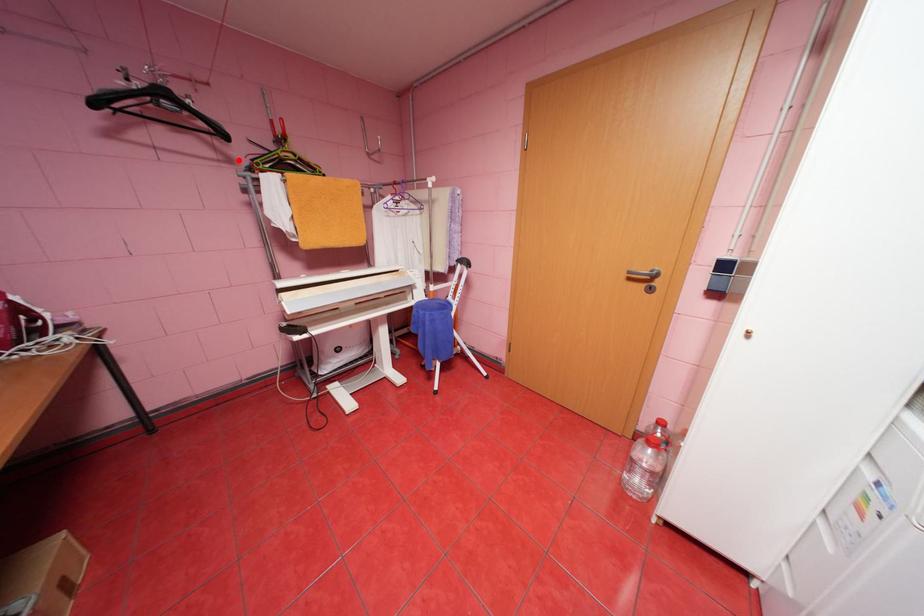
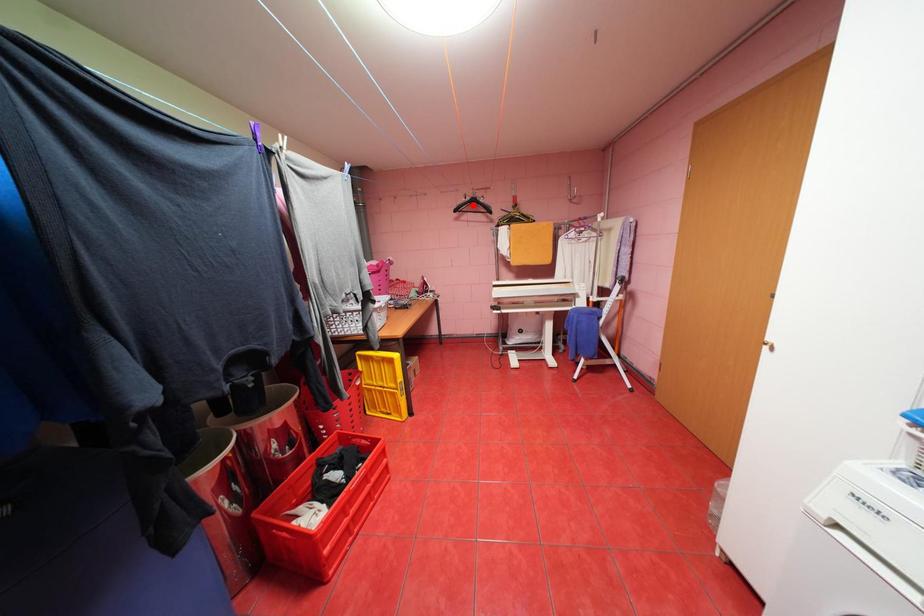
I am providing you with two images of the same scene from different viewpoints. A red point is marked on the first image and another point is marked on the second image. Are the points marked in image1 and image2 representing the same 3D position?

No